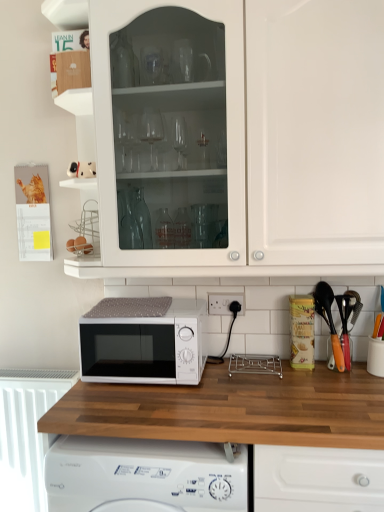
Question: From a real-world perspective, is white plastic electric outlet at lower center on white glossy cabinet at upper center?

Choices:
 (A) yes
 (B) no

Answer: (B)

Question: Is white plastic electric outlet at lower center smaller than white glossy cabinet at upper center?

Choices:
 (A) yes
 (B) no

Answer: (A)

Question: Is white plastic electric outlet at lower center to the left of white glossy cabinet at upper center from the viewer's perspective?

Choices:
 (A) yes
 (B) no

Answer: (A)

Question: Is white plastic electric outlet at lower center far from white glossy cabinet at upper center?

Choices:
 (A) no
 (B) yes

Answer: (A)

Question: From the image's perspective, is white plastic electric outlet at lower center located beneath white glossy cabinet at upper center?

Choices:
 (A) yes
 (B) no

Answer: (A)

Question: Is white plastic electric outlet at lower center surrounding white glossy cabinet at upper center?

Choices:
 (A) no
 (B) yes

Answer: (A)

Question: Considering the relative positions of white matte microwave at center and wooden at center in the image provided, is white matte microwave at center in front of wooden at center?

Choices:
 (A) yes
 (B) no

Answer: (B)

Question: Does white matte microwave at center have a lesser height compared to wooden at center?

Choices:
 (A) yes
 (B) no

Answer: (A)

Question: Is white matte microwave at center taller than wooden at center?

Choices:
 (A) no
 (B) yes

Answer: (A)

Question: Does white matte microwave at center have a smaller size compared to wooden at center?

Choices:
 (A) yes
 (B) no

Answer: (A)

Question: Does white matte microwave at center touch wooden at center?

Choices:
 (A) no
 (B) yes

Answer: (A)

Question: Considering the relative positions of white matte microwave at center and wooden at center in the image provided, is white matte microwave at center behind wooden at center?

Choices:
 (A) no
 (B) yes

Answer: (B)

Question: From the image's perspective, is white matte microwave at center on white plastic radiator at lower left?

Choices:
 (A) no
 (B) yes

Answer: (B)